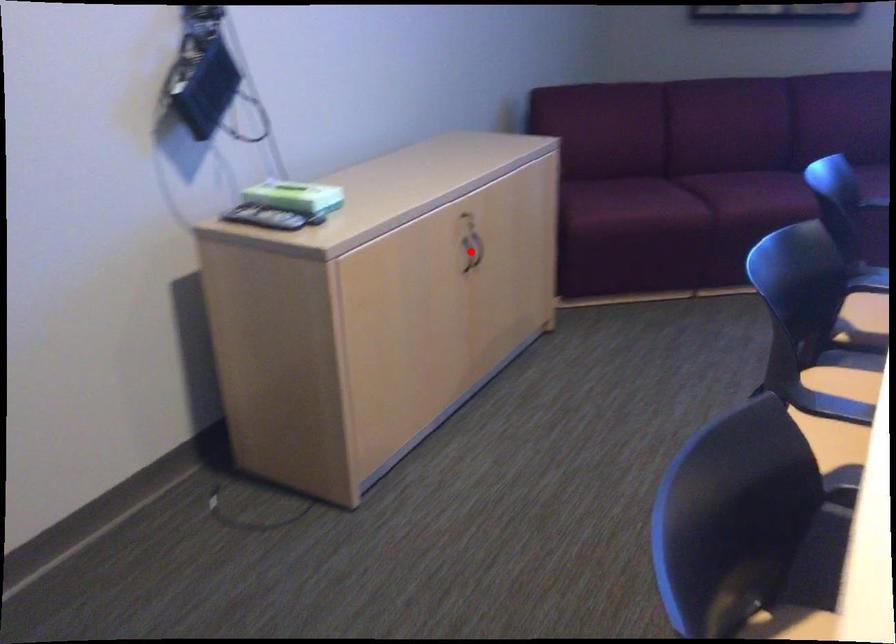
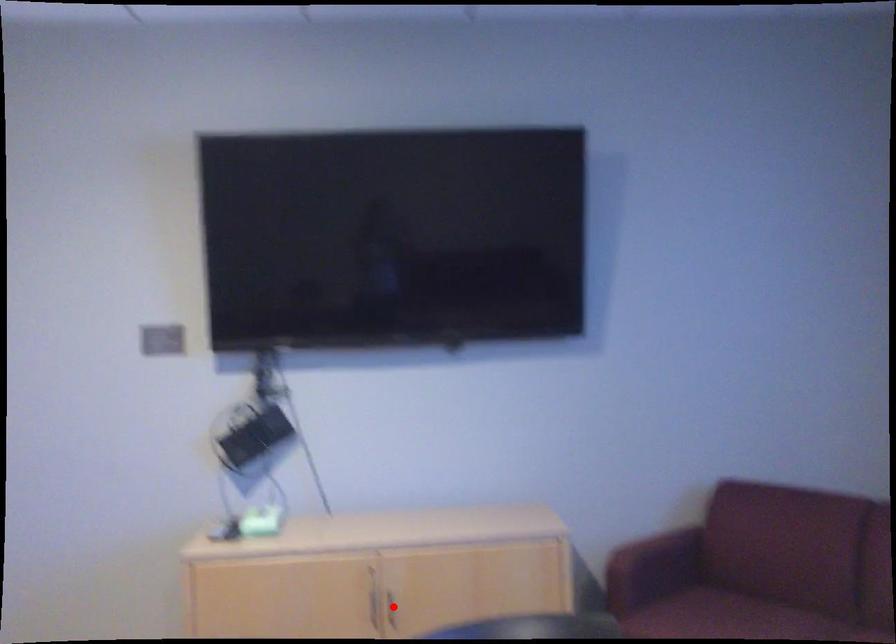
I am providing you with two images of the same scene from different viewpoints. A red point is marked on the first image and another point is marked on the second image. Do the highlighted points in image1 and image2 indicate the same real-world spot?

No